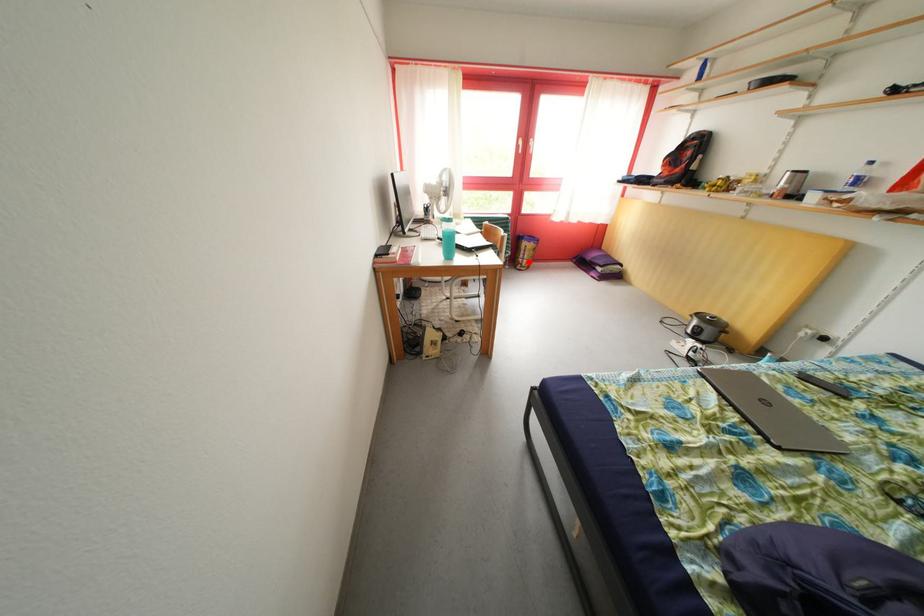
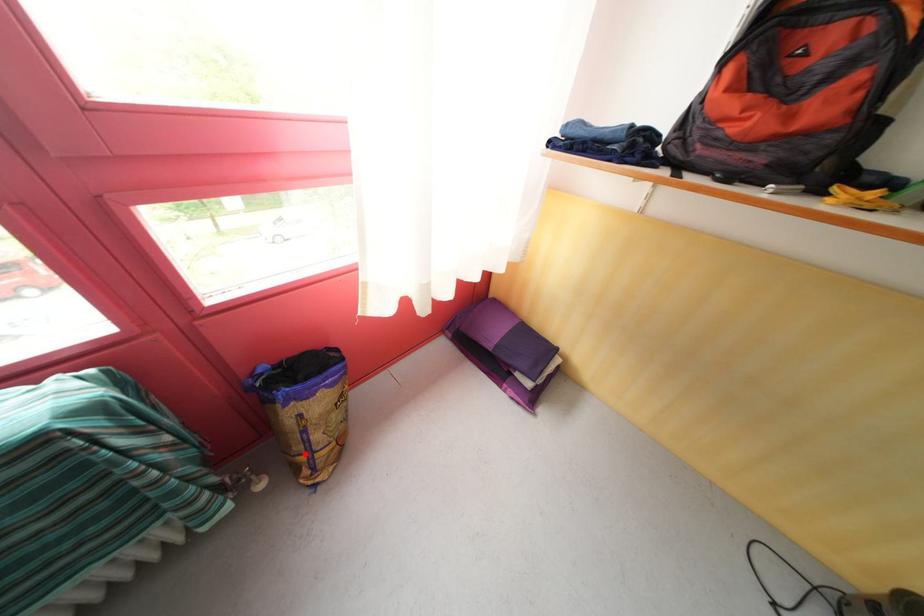
I am providing you with two images of the same scene from different viewpoints. A red point is marked on the first image and another point is marked on the second image. Do the highlighted points in image1 and image2 indicate the same real-world spot?

Yes